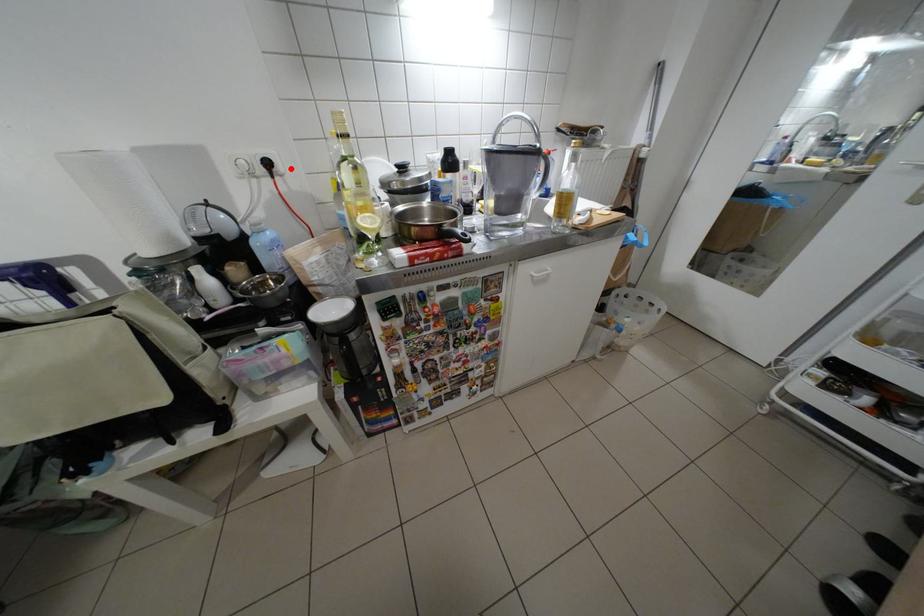
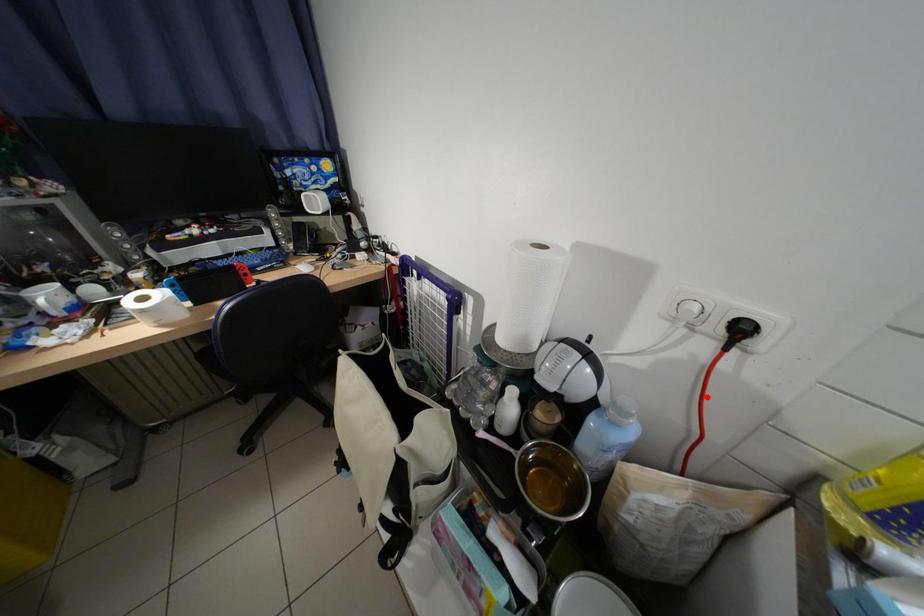
I am providing you with two images of the same scene from different viewpoints. A red point is marked on the first image and another point is marked on the second image. Does the point marked in image1 correspond to the same location as the one in image2?

No